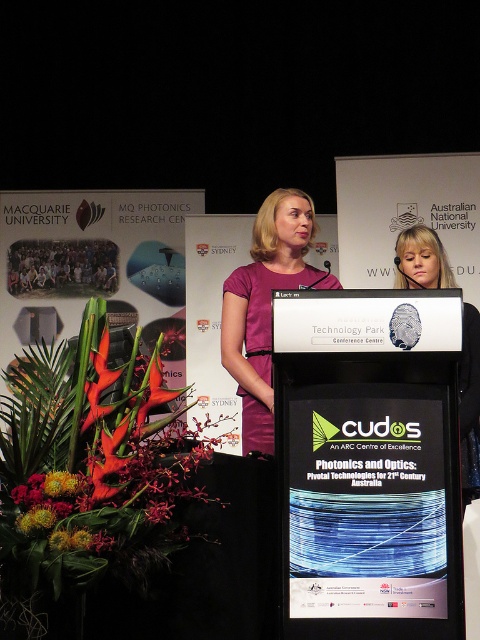
Can you confirm if purple matte dress at center is positioned to the left of matte purple dress at center?

Indeed, purple matte dress at center is positioned on the left side of matte purple dress at center.

Image resolution: width=480 pixels, height=640 pixels. Describe the element at coordinates (265, 305) in the screenshot. I see `purple matte dress at center` at that location.

Is point (264, 317) less distant than point (460, 371)?

No, it is not.

Find the location of a particular element. The width and height of the screenshot is (480, 640). purple matte dress at center is located at coordinates coord(265,305).